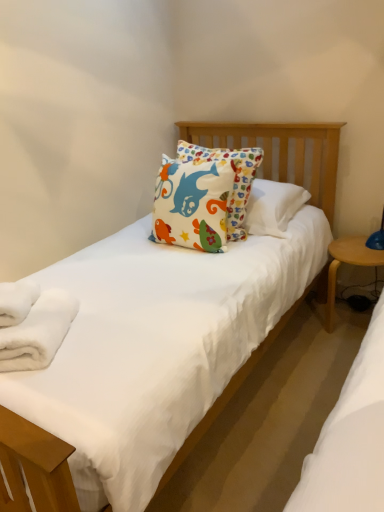
Question: From the image's perspective, is white soft towel at lower left, positioned as the 1th bath towel in top-to-bottom order, over white fluffy bath towel at lower left, placed as the second bath towel when sorted from top to bottom?

Choices:
 (A) yes
 (B) no

Answer: (A)

Question: Does white soft towel at lower left, the 2th bath towel when ordered from bottom to top, have a lesser width compared to white fluffy bath towel at lower left, which is counted as the 1th bath towel, starting from the bottom?

Choices:
 (A) no
 (B) yes

Answer: (B)

Question: Is white soft towel at lower left, the 2th bath towel when ordered from bottom to top, taller than white fluffy bath towel at lower left, placed as the second bath towel when sorted from top to bottom?

Choices:
 (A) no
 (B) yes

Answer: (A)

Question: Can you confirm if white soft towel at lower left, positioned as the 1th bath towel in top-to-bottom order, is positioned to the left of white fluffy bath towel at lower left, which is counted as the 1th bath towel, starting from the bottom?

Choices:
 (A) yes
 (B) no

Answer: (A)

Question: Is white soft towel at lower left, the 2th bath towel when ordered from bottom to top, bigger than white fluffy bath towel at lower left, which is counted as the 1th bath towel, starting from the bottom?

Choices:
 (A) yes
 (B) no

Answer: (B)

Question: From a real-world perspective, relative to light wood/wooden table at right, is white fluffy bath towel at lower left, which is counted as the 1th bath towel, starting from the bottom, vertically above or below?

Choices:
 (A) above
 (B) below

Answer: (A)

Question: In terms of size, does white fluffy bath towel at lower left, which is counted as the 1th bath towel, starting from the bottom, appear bigger or smaller than light wood/wooden table at right?

Choices:
 (A) small
 (B) big

Answer: (A)

Question: Is white fluffy bath towel at lower left, which is counted as the 1th bath towel, starting from the bottom, wider or thinner than light wood/wooden table at right?

Choices:
 (A) thin
 (B) wide

Answer: (B)

Question: Is white fluffy bath towel at lower left, placed as the second bath towel when sorted from top to bottom, taller or shorter than light wood/wooden table at right?

Choices:
 (A) tall
 (B) short

Answer: (B)

Question: In the image, is light wood/wooden table at right on the left side or the right side of white soft towel at lower left, the 2th bath towel when ordered from bottom to top?

Choices:
 (A) left
 (B) right

Answer: (B)

Question: Which is correct: light wood/wooden table at right is inside white soft towel at lower left, the 2th bath towel when ordered from bottom to top, or outside of it?

Choices:
 (A) inside
 (B) outside

Answer: (B)

Question: Looking at the image, does light wood/wooden table at right seem bigger or smaller compared to white soft towel at lower left, positioned as the 1th bath towel in top-to-bottom order?

Choices:
 (A) big
 (B) small

Answer: (A)

Question: In terms of width, does light wood/wooden table at right look wider or thinner when compared to white soft towel at lower left, positioned as the 1th bath towel in top-to-bottom order?

Choices:
 (A) wide
 (B) thin

Answer: (A)

Question: Relative to white soft towel at lower left, positioned as the 1th bath towel in top-to-bottom order, is white fluffy bath towel at lower left, placed as the second bath towel when sorted from top to bottom, in front or behind?

Choices:
 (A) front
 (B) behind

Answer: (A)

Question: In terms of width, does white fluffy bath towel at lower left, placed as the second bath towel when sorted from top to bottom, look wider or thinner when compared to white soft towel at lower left, positioned as the 1th bath towel in top-to-bottom order?

Choices:
 (A) thin
 (B) wide

Answer: (B)